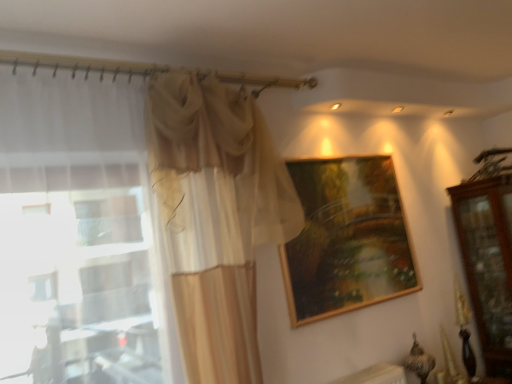
Question: From the image's perspective, is wooden frame at upper center on mahogany wooden dresser at right?

Choices:
 (A) yes
 (B) no

Answer: (A)

Question: Can mahogany wooden dresser at right be found inside wooden frame at upper center?

Choices:
 (A) no
 (B) yes

Answer: (A)

Question: From the image's perspective, would you say wooden frame at upper center is shown under mahogany wooden dresser at right?

Choices:
 (A) no
 (B) yes

Answer: (A)

Question: Is wooden frame at upper center in front of mahogany wooden dresser at right?

Choices:
 (A) no
 (B) yes

Answer: (B)

Question: Can you confirm if wooden frame at upper center is wider than mahogany wooden dresser at right?

Choices:
 (A) yes
 (B) no

Answer: (B)

Question: Considering the relative sizes of wooden frame at upper center and mahogany wooden dresser at right in the image provided, is wooden frame at upper center thinner than mahogany wooden dresser at right?

Choices:
 (A) yes
 (B) no

Answer: (A)

Question: Can you confirm if wooden frame at upper center is smaller than sheer beige curtain at left?

Choices:
 (A) no
 (B) yes

Answer: (B)

Question: From the image's perspective, is wooden frame at upper center below sheer beige curtain at left?

Choices:
 (A) no
 (B) yes

Answer: (B)

Question: Would you consider wooden frame at upper center to be distant from sheer beige curtain at left?

Choices:
 (A) no
 (B) yes

Answer: (A)

Question: Is sheer beige curtain at left surrounded by wooden frame at upper center?

Choices:
 (A) no
 (B) yes

Answer: (A)

Question: Is sheer beige curtain at left at the back of wooden frame at upper center?

Choices:
 (A) yes
 (B) no

Answer: (B)

Question: Is wooden frame at upper center with sheer beige curtain at left?

Choices:
 (A) yes
 (B) no

Answer: (B)

Question: Considering the relative sizes of mahogany wooden dresser at right and wooden frame at upper center in the image provided, is mahogany wooden dresser at right wider than wooden frame at upper center?

Choices:
 (A) no
 (B) yes

Answer: (B)